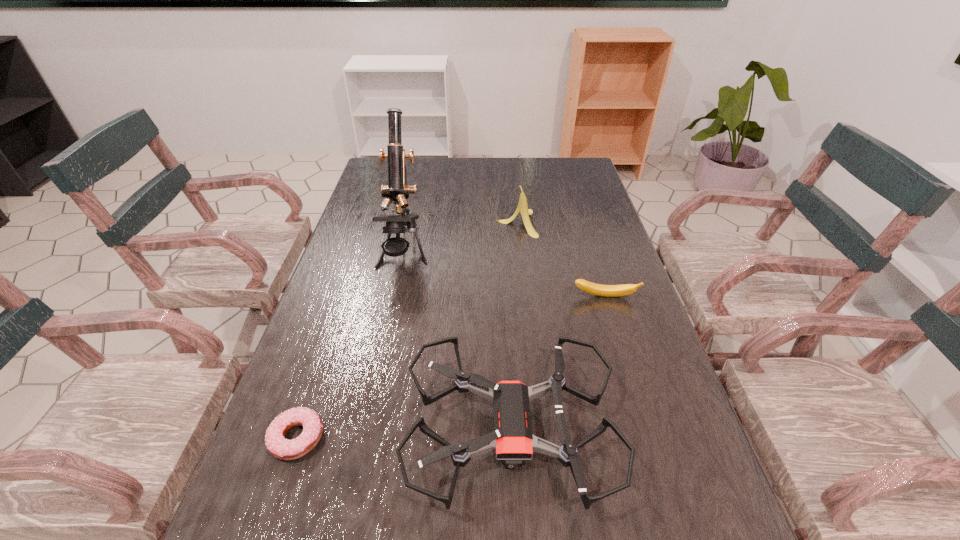
This screenshot has width=960, height=540. In order to click on unoccupied area between the left banana and the leftmost object in this screenshot , I will do `click(407, 330)`.

Locate an element on the screen. The width and height of the screenshot is (960, 540). free space between the second shortest object and the microscope is located at coordinates (504, 274).

This screenshot has width=960, height=540. Identify the location of vacant area that lies between the leftmost object and the fourth tallest object. point(451,367).

Select which object is the third closest to the third tallest object. Please provide its 2D coordinates. Your answer should be formatted as a tuple, i.e. [(x, y)], where the tuple contains the x and y coordinates of a point satisfying the conditions above.

[(397, 190)]

Identify which object is the third nearest to the third farthest object. Please provide its 2D coordinates. Your answer should be formatted as a tuple, i.e. [(x, y)], where the tuple contains the x and y coordinates of a point satisfying the conditions above.

[(397, 190)]